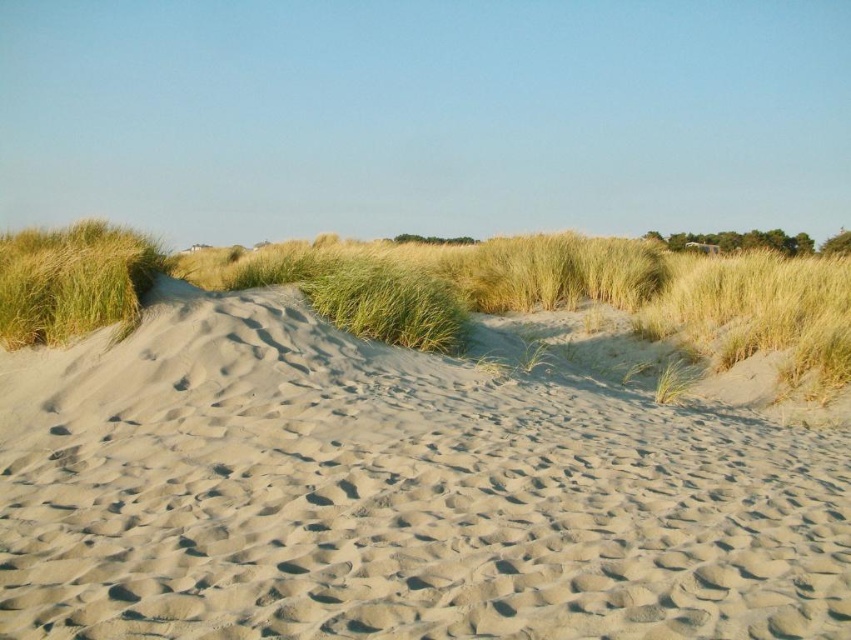
You are a hiker trying to cross the sandy landscape. You have two options to walk on either the smooth sand at center or the green grassy at left. Which path would be more stable under your feet?

The smooth sand at center is larger in size than the green grassy at left, so the smooth sand at center would provide a more stable path for walking.

You are standing at the point closer to the camera in the image. Which point are you standing at, point (683,256) or point (75,253)?

You are standing at point (75,253) because it is closer to the camera than point (683,256).

You are a hiker trying to cross the sandy landscape. You have two options for paths. One is the smooth sand at center and the other is the green grass at center. Which path is narrower?

The smooth sand at center is thinner than green grass at center, so the smooth sand at center is the narrower path.